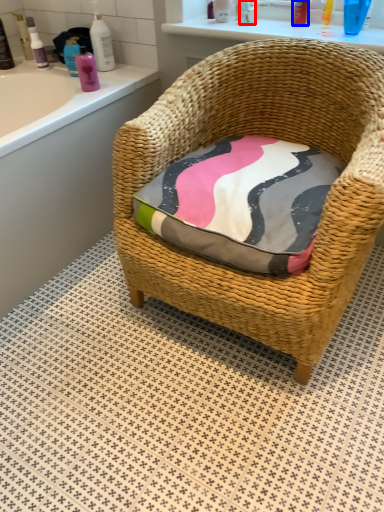
Question: Which of the following is the closest to the observer, toiletry (highlighted by a red box) or toiletry (highlighted by a blue box)?

Choices:
 (A) toiletry
 (B) toiletry

Answer: (B)